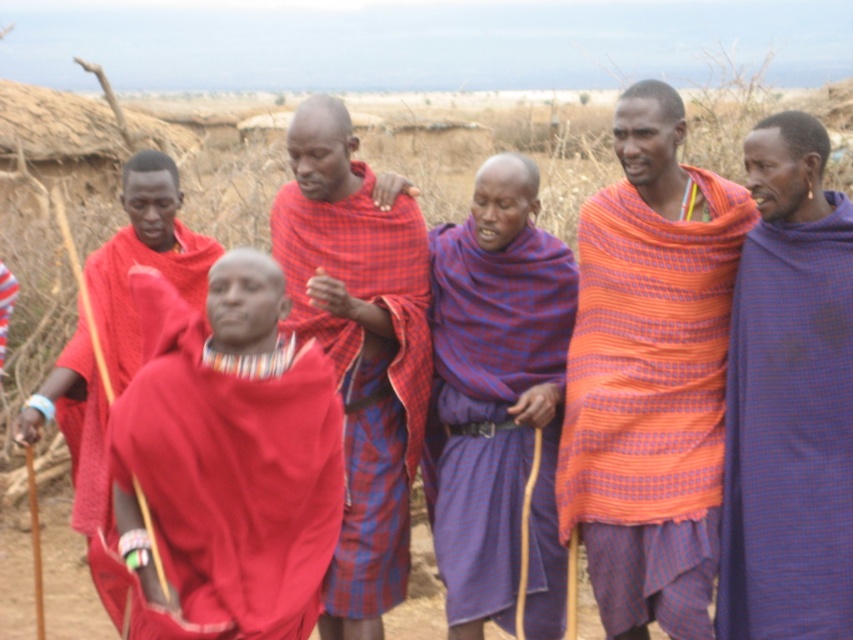
Question: In this image, where is orange woven cloth at center located relative to blue plaid shawl at center?

Choices:
 (A) above
 (B) below

Answer: (A)

Question: Is matte red shawl at center bigger than matte red shawl at left?

Choices:
 (A) no
 (B) yes

Answer: (B)

Question: Among these points, which one is nearest to the camera?

Choices:
 (A) (393, 588)
 (B) (223, 413)
 (C) (106, 307)

Answer: (B)

Question: Which object is farther from the camera taking this photo?

Choices:
 (A) blue woven cloth at center
 (B) matte red shawl at left

Answer: (B)

Question: Does blue woven cloth at center have a greater width compared to blue plaid shawl at center?

Choices:
 (A) no
 (B) yes

Answer: (A)

Question: Which point appears farthest from the camera in this image?

Choices:
 (A) (136, 344)
 (B) (242, 248)

Answer: (B)